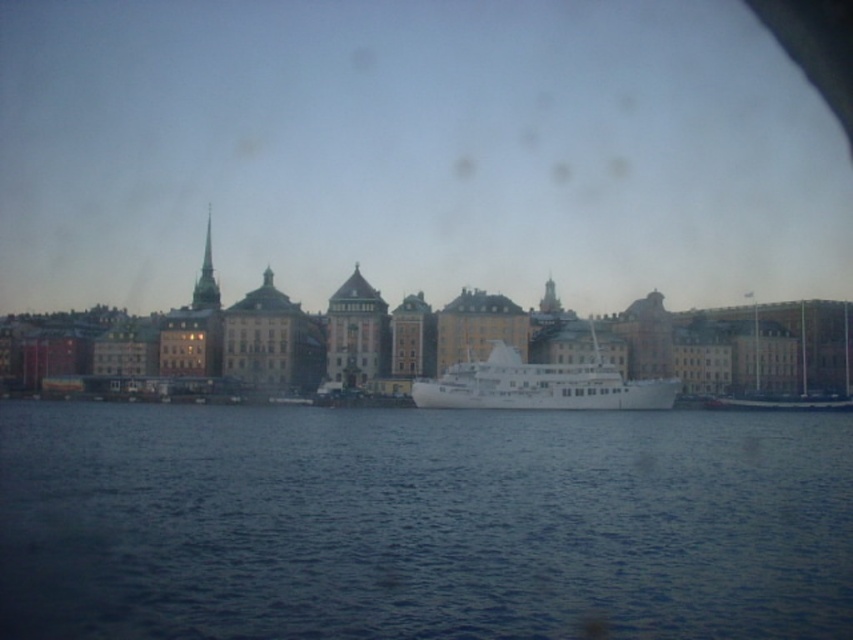
Question: Which of the following is the farthest from the observer?

Choices:
 (A) blue liquid water at center
 (B) white glossy ship at center

Answer: (B)

Question: Is blue liquid water at center behind white glossy ship at center?

Choices:
 (A) yes
 (B) no

Answer: (B)

Question: Which object appears farthest from the camera in this image?

Choices:
 (A) blue liquid water at center
 (B) white glossy ship at center

Answer: (B)

Question: Is blue liquid water at center to the right of white glossy ship at center from the viewer's perspective?

Choices:
 (A) yes
 (B) no

Answer: (B)

Question: Can you confirm if blue liquid water at center is thinner than white glossy ship at center?

Choices:
 (A) no
 (B) yes

Answer: (A)